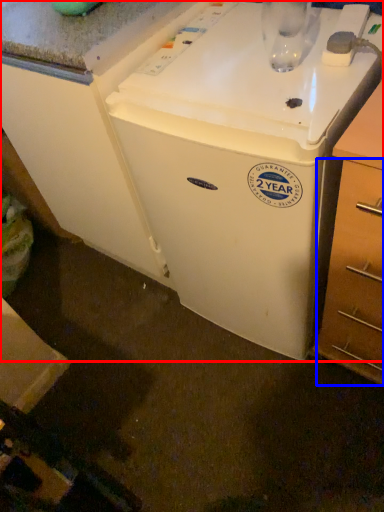
Question: Which object is closer to the camera taking this photo, home appliance (highlighted by a red box) or drawer (highlighted by a blue box)?

Choices:
 (A) home appliance
 (B) drawer

Answer: (B)